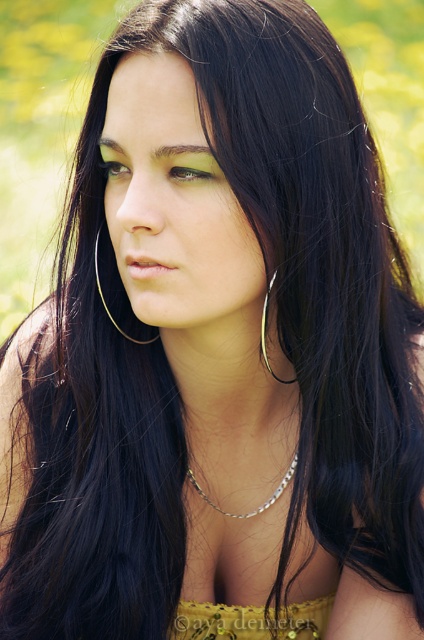
You are a fashion designer analyzing the image. You need to determine the position of the yellow lace dress at center relative to the yellow flowers in the background. Is the dress in front of or behind the flowers?

The yellow lace dress at center is located at point coordinates which place it in front of the yellow flowers in the background since the flowers are part of the blurred background, indicating depth where the subject and dress are closer to the viewer.

You are a photographer adjusting the focus on your camera. You want to ensure both the yellow lace dress at center and the gold metallic hoop at center are in sharp focus. Based on their positions, which object should you focus on to achieve this?

Since the gold metallic hoop at center is behind the yellow lace dress at center, you should focus on the gold metallic hoop at center to ensure both objects are in sharp focus.